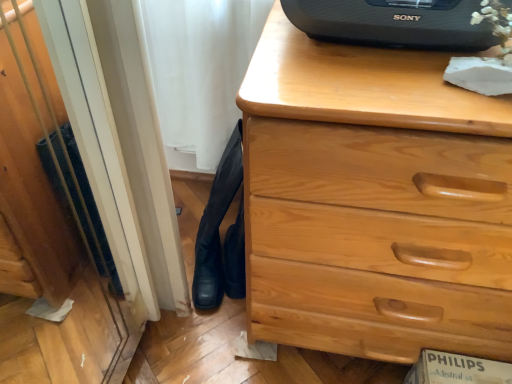
Question: Is light wood chest of drawers at center not within black leather boots at lower left?

Choices:
 (A) no
 (B) yes

Answer: (B)

Question: From a real-world perspective, is light wood chest of drawers at center located higher than black leather boots at lower left?

Choices:
 (A) no
 (B) yes

Answer: (B)

Question: Considering the relative sizes of light wood chest of drawers at center and black leather boots at lower left in the image provided, is light wood chest of drawers at center thinner than black leather boots at lower left?

Choices:
 (A) no
 (B) yes

Answer: (A)

Question: From a real-world perspective, is light wood chest of drawers at center positioned under black leather boots at lower left based on gravity?

Choices:
 (A) no
 (B) yes

Answer: (A)

Question: Is light wood chest of drawers at center to the left of black leather boots at lower left from the viewer's perspective?

Choices:
 (A) yes
 (B) no

Answer: (B)

Question: In terms of width, does black plastic speaker at upper center look wider or thinner when compared to black leather boots at lower left?

Choices:
 (A) thin
 (B) wide

Answer: (A)

Question: Is black plastic speaker at upper center to the left or to the right of black leather boots at lower left in the image?

Choices:
 (A) right
 (B) left

Answer: (A)

Question: Is black plastic speaker at upper center taller or shorter than black leather boots at lower left?

Choices:
 (A) short
 (B) tall

Answer: (A)

Question: Would you say black plastic speaker at upper center is inside or outside black leather boots at lower left?

Choices:
 (A) outside
 (B) inside

Answer: (A)

Question: From a real-world perspective, is light wood chest of drawers at center physically located above or below black plastic speaker at upper center?

Choices:
 (A) above
 (B) below

Answer: (B)

Question: Considering the positions of point (462, 125) and point (453, 6), is point (462, 125) closer or farther from the camera than point (453, 6)?

Choices:
 (A) closer
 (B) farther

Answer: (A)

Question: In terms of width, does light wood chest of drawers at center look wider or thinner when compared to black plastic speaker at upper center?

Choices:
 (A) thin
 (B) wide

Answer: (B)

Question: Relative to black plastic speaker at upper center, is light wood chest of drawers at center in front or behind?

Choices:
 (A) behind
 (B) front

Answer: (B)

Question: Considering the positions of black leather boots at lower left and black plastic speaker at upper center in the image, is black leather boots at lower left wider or thinner than black plastic speaker at upper center?

Choices:
 (A) wide
 (B) thin

Answer: (A)

Question: From the image's perspective, relative to black plastic speaker at upper center, is black leather boots at lower left above or below?

Choices:
 (A) below
 (B) above

Answer: (A)